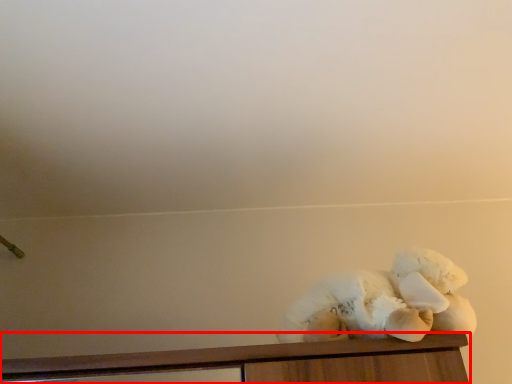
Question: From the image's perspective, where is furniture (annotated by the red box) located relative to teddy bear?

Choices:
 (A) above
 (B) below

Answer: (B)